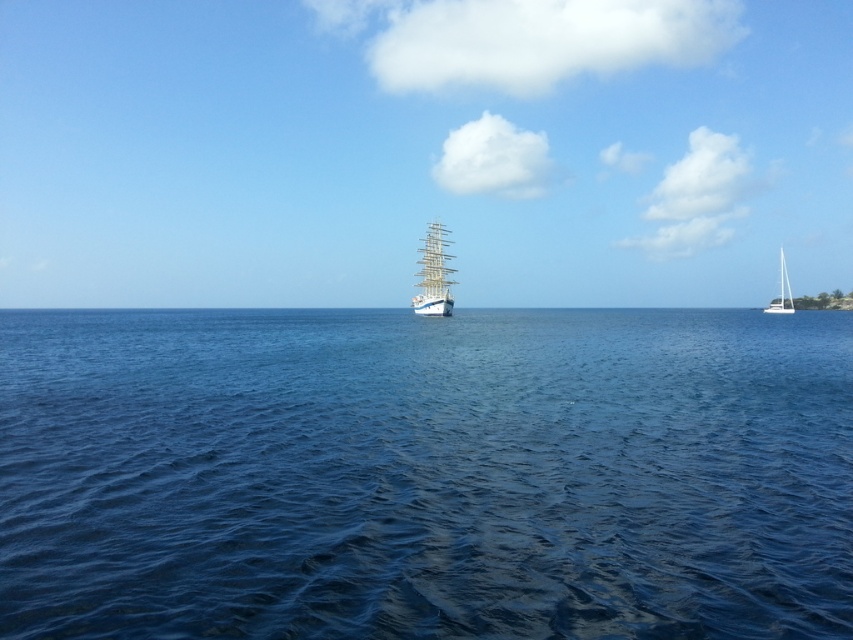
Can you confirm if blue smooth water at center is smaller than white glossy sailboat at right?

Correct, blue smooth water at center occupies less space than white glossy sailboat at right.

Who is more forward, (596, 419) or (780, 285)?

Point (596, 419)

Find the location of `blue smooth water at center`. blue smooth water at center is located at coordinates (x=425, y=474).

Consider the image. Does blue smooth water at center have a smaller size compared to white wooden ship at center?

No, blue smooth water at center is not smaller than white wooden ship at center.

Who is more forward, (428, 588) or (428, 257)?

Point (428, 588)

The height and width of the screenshot is (640, 853). What do you see at coordinates (425, 474) in the screenshot? I see `blue smooth water at center` at bounding box center [425, 474].

What are the coordinates of `blue smooth water at center` in the screenshot? It's located at (425, 474).

Can you confirm if white wooden ship at center is thinner than white glossy sailboat at right?

Yes, white wooden ship at center is thinner than white glossy sailboat at right.

Who is taller, white wooden ship at center or white glossy sailboat at right?

Standing taller between the two is white glossy sailboat at right.

Is point (428, 301) more distant than point (790, 292)?

No, it is not.

Where is `white wooden ship at center`? This screenshot has width=853, height=640. white wooden ship at center is located at coordinates (433, 275).